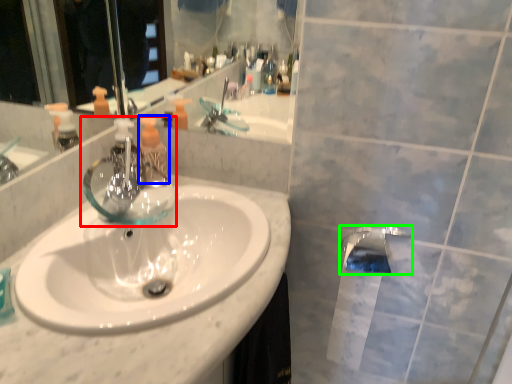
Question: Based on their relative distances, which object is farther from tap (highlighted by a red box)? Choose from toiletry (highlighted by a blue box) and tap (highlighted by a green box).

Choices:
 (A) toiletry
 (B) tap

Answer: (B)